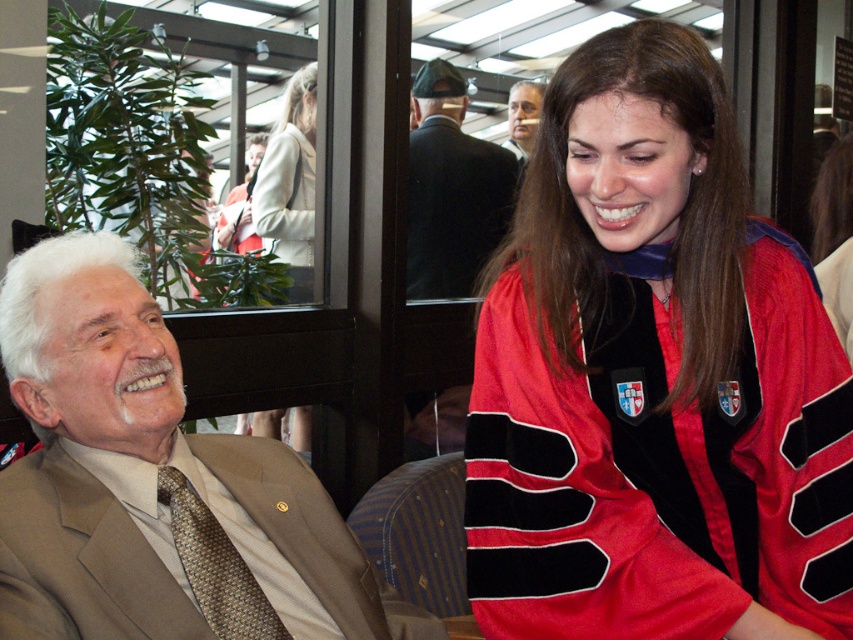
Question: Among these points, which one is farthest from the camera?

Choices:
 (A) (520, 115)
 (B) (248, 224)
 (C) (767, 472)
 (D) (434, 76)

Answer: (A)

Question: Does dark suit jacket at upper center lie in front of smooth skin face at upper center?

Choices:
 (A) no
 (B) yes

Answer: (B)

Question: Among these objects, which one is farthest from the camera?

Choices:
 (A) white wool coat at upper center
 (B) dark suit jacket at upper center

Answer: (B)

Question: Is the position of matte black tie at upper center less distant than that of smooth skin face at upper center?

Choices:
 (A) no
 (B) yes

Answer: (B)

Question: Which of the following is the closest to the observer?

Choices:
 (A) (88, 625)
 (B) (254, 244)
 (C) (498, 161)
 (D) (596, 56)

Answer: (D)

Question: Can you confirm if brown textured tie at left is bigger than smooth skin face at upper center?

Choices:
 (A) yes
 (B) no

Answer: (B)